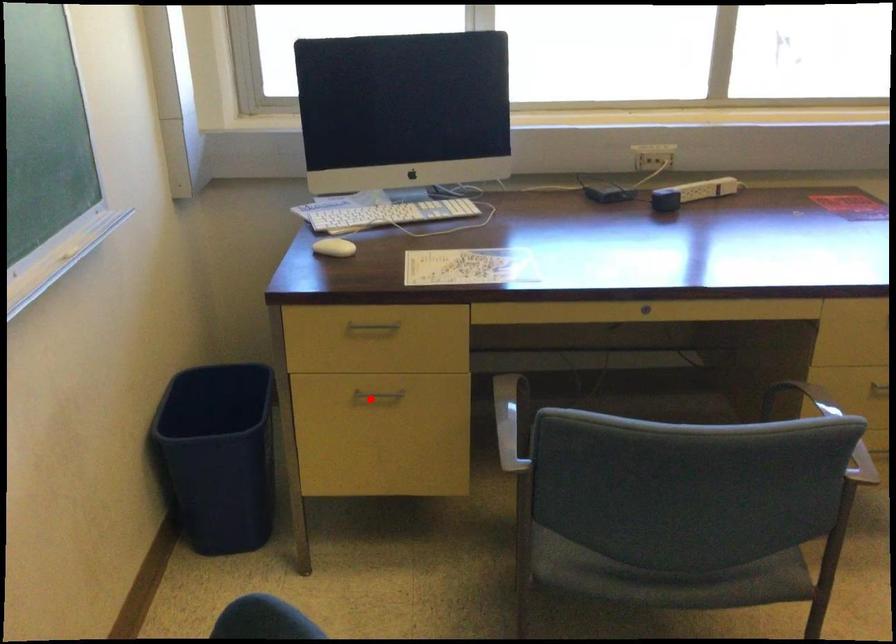
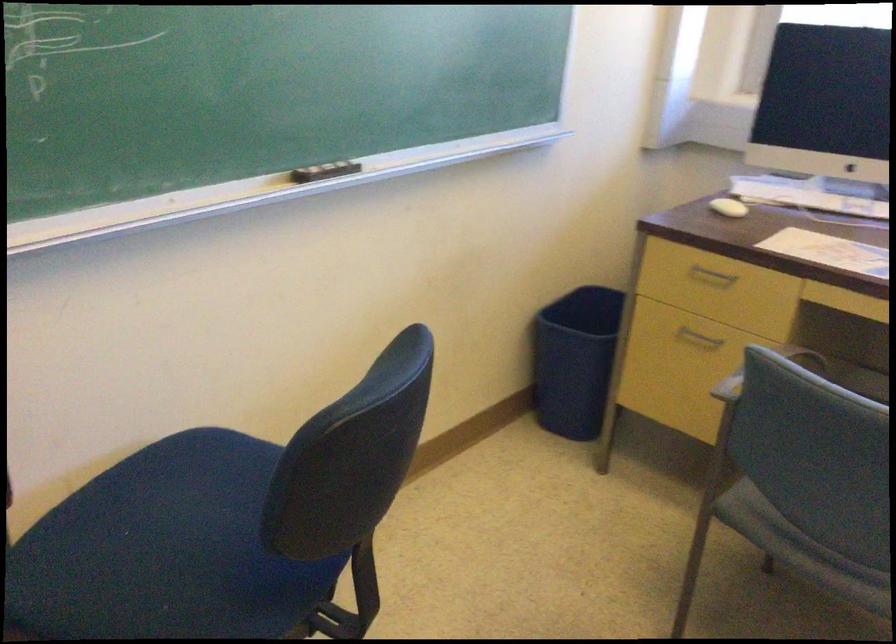
In the second image, find the point that corresponds to the highlighted location in the first image.

(698, 337)